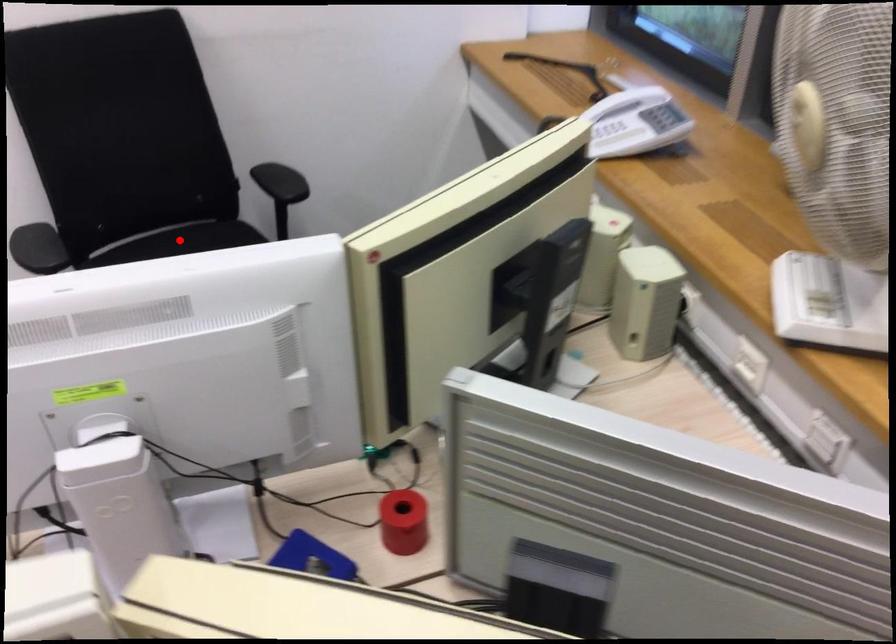
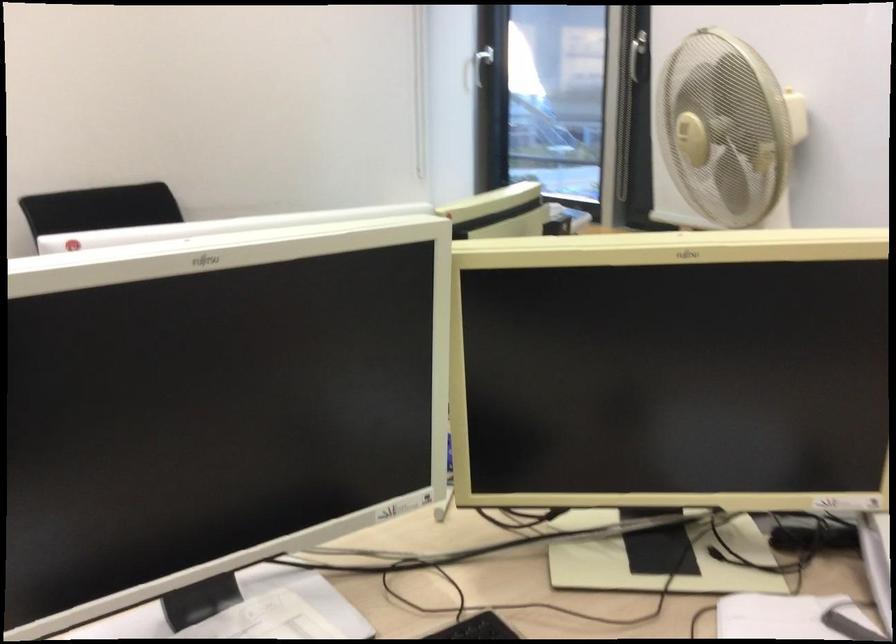
Question: I am providing you with two images of the same scene from different viewpoints. A red point is marked on the first image. At the location where the point appears in image 1, is it still visible in image 2?

Choices:
 (A) Yes
 (B) No

Answer: (B)